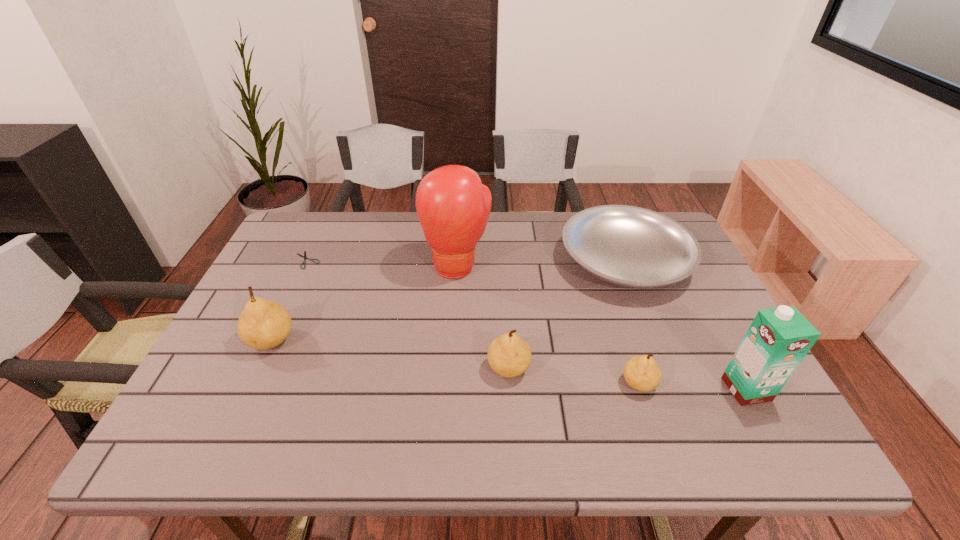
You are a GUI agent. You are given a task and a screenshot of the screen. Output one action in this format:
    pyautogui.click(x=<x>, y=<y>)
    Task: Click on the free space at the left edge of the desktop
    Image resolution: width=960 pixels, height=540 pixels.
    Given the screenshot: What is the action you would take?
    click(x=303, y=280)

Where is `vacant space at the far left corner of the desktop`? vacant space at the far left corner of the desktop is located at coordinates (287, 239).

The height and width of the screenshot is (540, 960). Identify the location of free region at the near right corner of the desktop. (773, 401).

The width and height of the screenshot is (960, 540). I want to click on vacant space that is in between the shortest pear and the fourth shortest object, so click(574, 376).

The width and height of the screenshot is (960, 540). What are the coordinates of `blank region between the carton and the boxing glove` in the screenshot? It's located at (602, 328).

The width and height of the screenshot is (960, 540). In order to click on vacant space that is in between the tallest object and the second pear from left to right in this screenshot , I will do `click(483, 317)`.

The image size is (960, 540). In order to click on free space between the rightmost pear and the carton in this screenshot , I will do `click(692, 386)`.

In order to click on free space that is in between the shortest object and the tallest object in this screenshot , I will do `click(382, 263)`.

Find the location of a particular element. vacant area that lies between the shortest object and the leftmost pear is located at coordinates coord(290,300).

You are a GUI agent. You are given a task and a screenshot of the screen. Output one action in this format:
    pyautogui.click(x=<x>, y=<y>)
    Task: Click on the free space between the second shortest object and the fifth tallest object
    This screenshot has height=540, width=960.
    Given the screenshot: What is the action you would take?
    pyautogui.click(x=632, y=322)